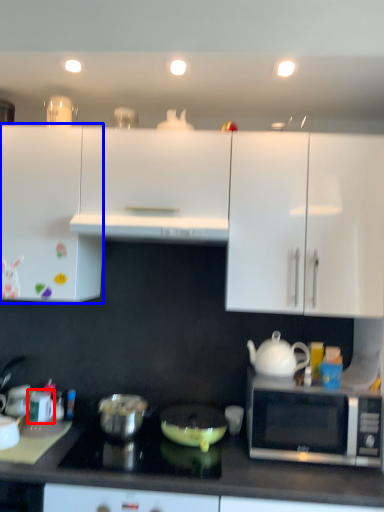
Question: Which object appears closest to the camera in this image, appliance (highlighted by a red box) or cabinetry (highlighted by a blue box)?

Choices:
 (A) appliance
 (B) cabinetry

Answer: (B)